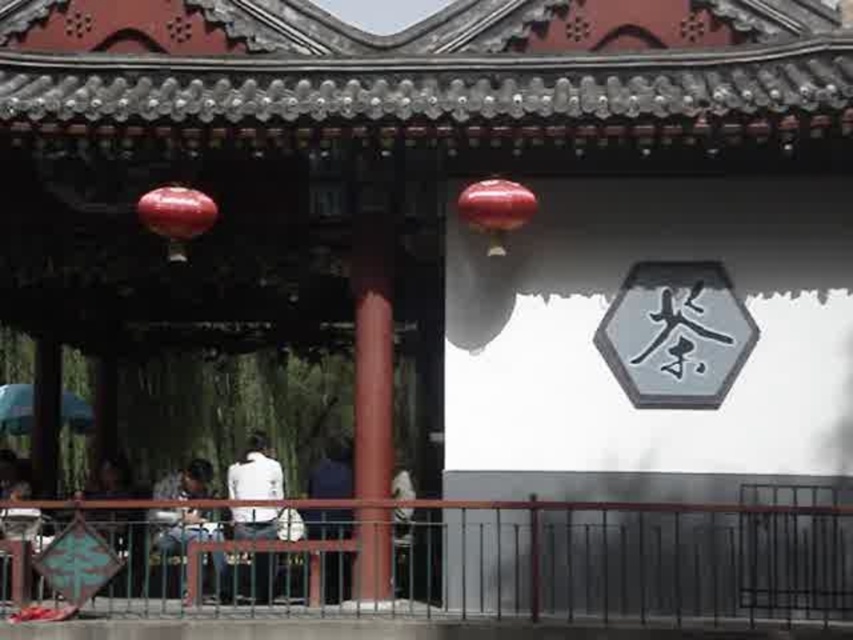
Between point (381, 412) and point (323, 596), which one is positioned in front?

Positioned in front is point (381, 412).

Which of these two, smooth red pillar at center or dark blue shirt at center, stands shorter?

dark blue shirt at center is shorter.

The width and height of the screenshot is (853, 640). What do you see at coordinates (372, 358) in the screenshot?
I see `smooth red pillar at center` at bounding box center [372, 358].

Find the location of a particular element. The width and height of the screenshot is (853, 640). smooth red pillar at center is located at coordinates (372, 358).

Is dark blue shirt at center to the right of dark blue jeans at lower center from the viewer's perspective?

Yes, dark blue shirt at center is to the right of dark blue jeans at lower center.

Is dark blue shirt at center below dark blue jeans at lower center?

No, dark blue shirt at center is not below dark blue jeans at lower center.

Where is `dark blue shirt at center`? dark blue shirt at center is located at coordinates click(332, 472).

Image resolution: width=853 pixels, height=640 pixels. Identify the location of dark blue shirt at center. (332, 472).

Which is below, metallic black railing at lower center or dark blue jeans at lower center?

metallic black railing at lower center is lower down.

Does metallic black railing at lower center appear over dark blue jeans at lower center?

Incorrect, metallic black railing at lower center is not positioned above dark blue jeans at lower center.

Who is more forward, (65,596) or (218,528)?

Positioned in front is point (65,596).

Locate an element on the screen. metallic black railing at lower center is located at coordinates (477, 561).